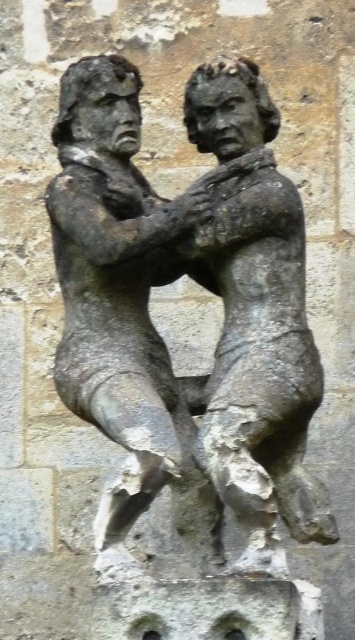
Is stone statue of man at center below bronze statue at center?

Yes, stone statue of man at center is below bronze statue at center.

Who is more distant from viewer, (48, 196) or (190, 264)?

The point (190, 264) is behind.

Describe the element at coordinates (121, 298) in the screenshot. I see `stone statue of man at center` at that location.

You are a GUI agent. You are given a task and a screenshot of the screen. Output one action in this format:
    pyautogui.click(x=<x>, y=<y>)
    Task: Click on the stone statue of man at center
    
    Given the screenshot: What is the action you would take?
    pyautogui.click(x=121, y=298)